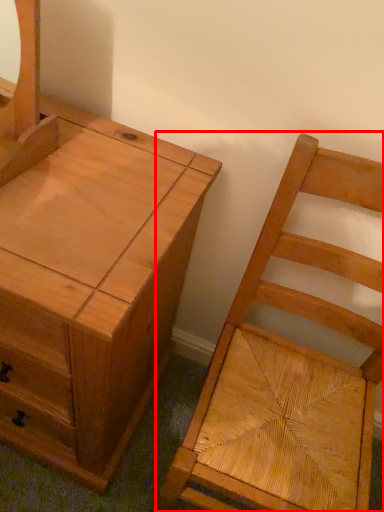
Question: Considering the relative positions of chair (annotated by the red box) and chest of drawers in the image provided, where is chair (annotated by the red box) located with respect to the staircase?

Choices:
 (A) right
 (B) left

Answer: (A)